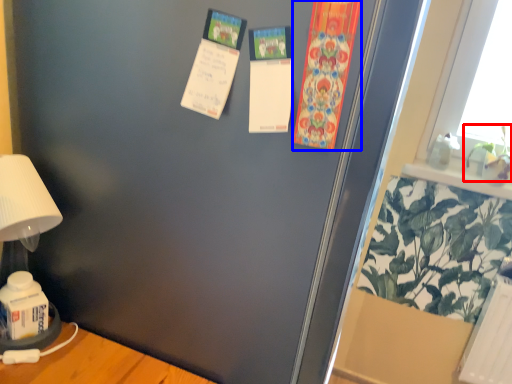
Question: Which object appears farthest to the camera in this image, plant (highlighted by a red box) or postcard (highlighted by a blue box)?

Choices:
 (A) plant
 (B) postcard

Answer: (A)